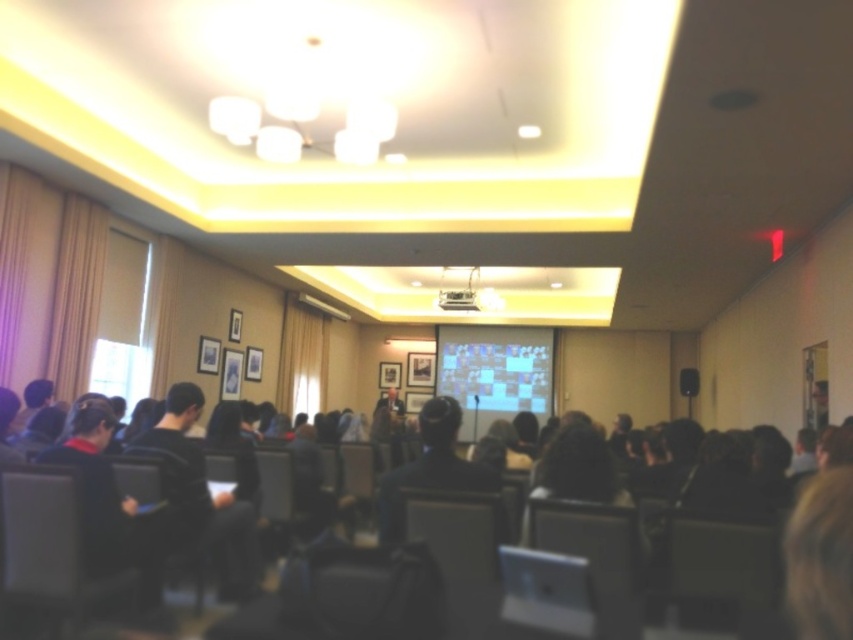
You are sitting in the front row of the conference room and want to see both the matte white projection screen at center and the black matte speaker at center. Which object is closer to you?

The matte white projection screen at center is closer to you than the black matte speaker at center because it is further to the viewer.

You are an event organizer setting up the conference room. You need to ensure that the white plastic projector at upper center and the black matte speaker at center are visible to all attendees. Considering their heights, which one might require adjustment to be seen better?

The white plastic projector at upper center is shorter than the black matte speaker at center, so the projector might need to be raised or placed on a higher surface to ensure visibility for all attendees.

You are standing in the conference room and want to walk from the point closer to you to the farther point. Which path should you take to reach point (691, 387) from point (456, 298)?

Since point (456, 298) is closer to the viewer than point (691, 387), you should move forward in the direction of the farther point to reach it.